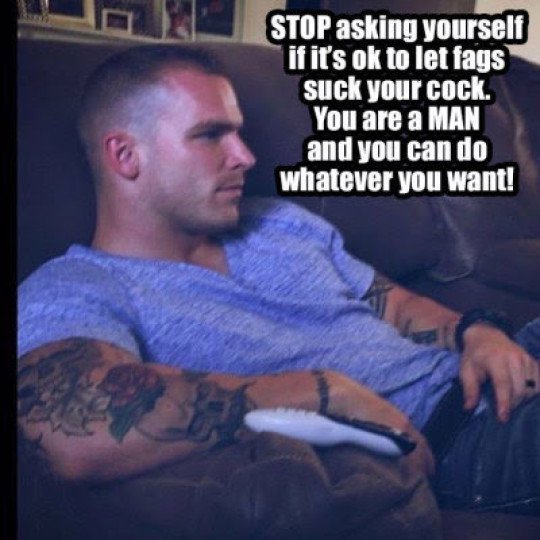
Locate an element on the screen. This screenshot has width=540, height=540. tv remote is located at coordinates (322, 430).